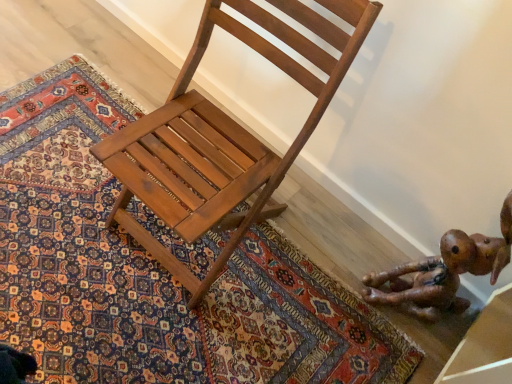
Identify the location of unoccupied area in front of shiny brown wood chair at center. (161, 326).